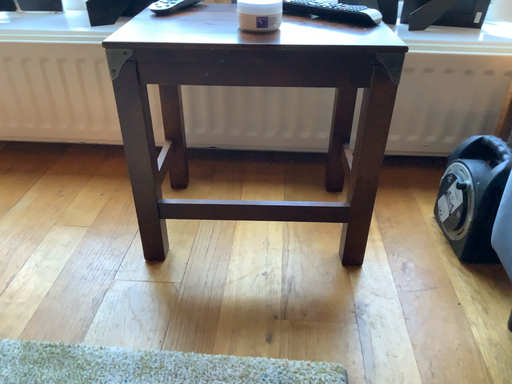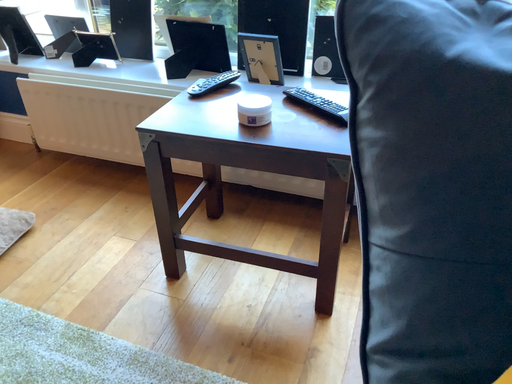
Question: Which way did the camera rotate in the video?

Choices:
 (A) rotated left
 (B) rotated right

Answer: (A)